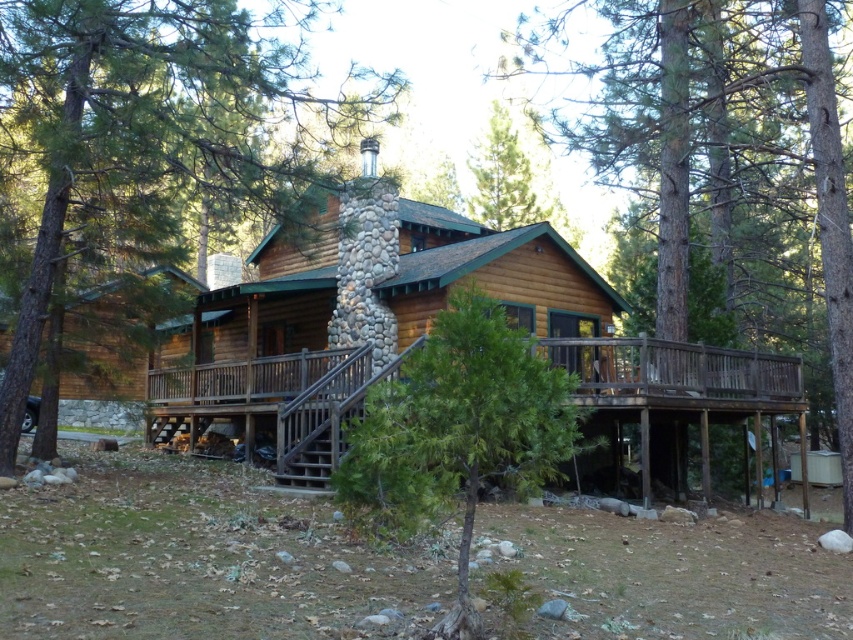
Which is in front, point (286, 403) or point (479, 323)?

Point (479, 323)

Can you confirm if wooden cabin at center is taller than green textured tree at center?

Yes, wooden cabin at center is taller than green textured tree at center.

Locate an element on the screen. This screenshot has width=853, height=640. wooden cabin at center is located at coordinates (358, 317).

Is point (33, 314) closer to viewer compared to point (299, 426)?

Yes, it is.

Locate an element on the screen. green leafy tree at center is located at coordinates (142, 140).

Where is `green leafy tree at center`? Image resolution: width=853 pixels, height=640 pixels. green leafy tree at center is located at coordinates (142, 140).

Measure the distance between point (637,52) and camera.

Point (637,52) and camera are 15.22 meters apart.

Between smooth brown wood at center and green textured tree at center, which one has less height?

Standing shorter between the two is green textured tree at center.

Where is `smooth brown wood at center`? This screenshot has height=640, width=853. smooth brown wood at center is located at coordinates (722, 134).